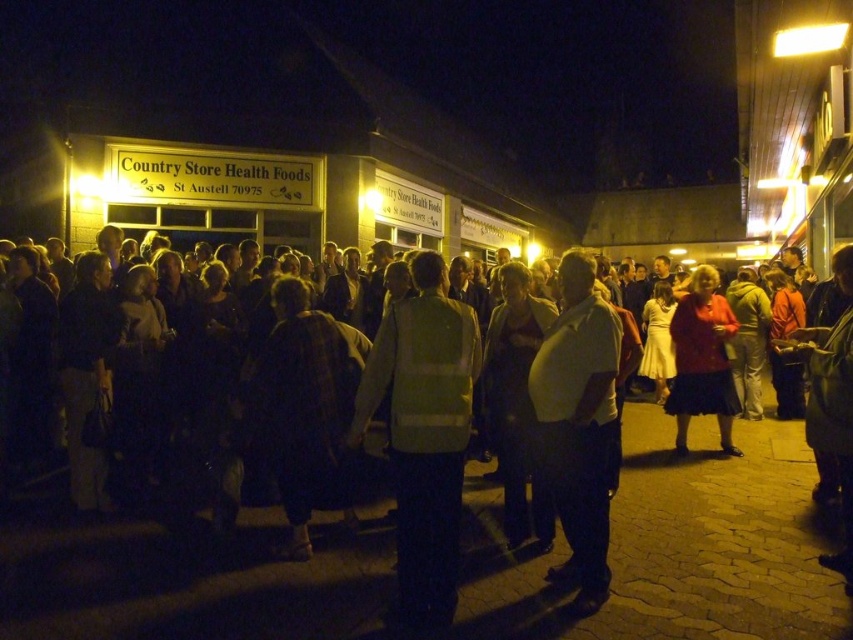
Question: Does dark clothing crowd at center appear on the right side of reflective yellow vest at center?

Choices:
 (A) no
 (B) yes

Answer: (A)

Question: Is white matte shirt at center wider than matte red coat at center?

Choices:
 (A) no
 (B) yes

Answer: (A)

Question: Does white matte shirt at center appear under matte red coat at center?

Choices:
 (A) no
 (B) yes

Answer: (B)

Question: Estimate the real-world distances between objects in this image. Which object is farther from the white matte shirt at center?

Choices:
 (A) dark clothing crowd at center
 (B) matte red coat at center
 (C) reflective yellow vest at center

Answer: (B)

Question: Based on their relative distances, which object is nearer to the matte red coat at center?

Choices:
 (A) reflective yellow vest at center
 (B) dark clothing crowd at center
 (C) white matte shirt at center

Answer: (C)

Question: Which point is farther to the camera?

Choices:
 (A) (698, 305)
 (B) (795, 609)
 (C) (602, 321)

Answer: (A)